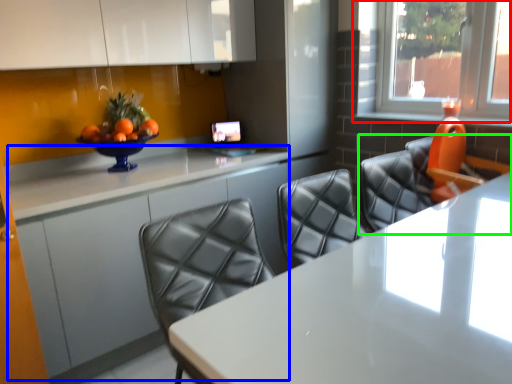
Question: Estimate the real-world distances between objects in this image. Which object is closer to window (highlighted by a red box), counter (highlighted by a blue box) or chair (highlighted by a green box)?

Choices:
 (A) counter
 (B) chair

Answer: (B)